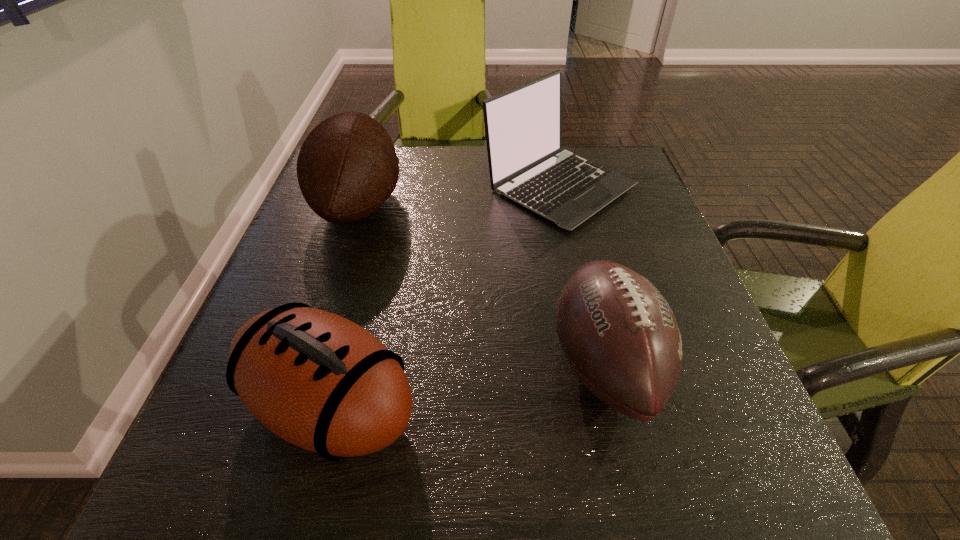
Identify the location of laptop_computer. (523, 126).

Image resolution: width=960 pixels, height=540 pixels. In order to click on the farthest football (American) in this screenshot , I will do `click(347, 167)`.

The image size is (960, 540). What are the coordinates of `the rightmost football (American)` in the screenshot? It's located at (619, 335).

Locate an element on the screen. free space located at the front screen of the laptop_computer is located at coordinates (598, 359).

The width and height of the screenshot is (960, 540). I want to click on vacant space located on the laces of the farthest football (American), so click(x=526, y=205).

At what (x,y) coordinates should I click in order to perform the action: click on vacant space located on the front of the rightmost football (American). Please return your answer as a coordinate pair (x, y). This screenshot has width=960, height=540. Looking at the image, I should click on (633, 484).

You are a GUI agent. You are given a task and a screenshot of the screen. Output one action in this format:
    pyautogui.click(x=<x>, y=<y>)
    Task: Click on the laptop_computer that is at the far edge
    The height and width of the screenshot is (540, 960).
    Given the screenshot: What is the action you would take?
    pyautogui.click(x=523, y=126)

Image resolution: width=960 pixels, height=540 pixels. I want to click on football that is at the far edge, so click(347, 167).

I want to click on laptop_computer located in the right edge section of the desktop, so click(523, 126).

The width and height of the screenshot is (960, 540). I want to click on football (American) located in the right edge section of the desktop, so click(619, 335).